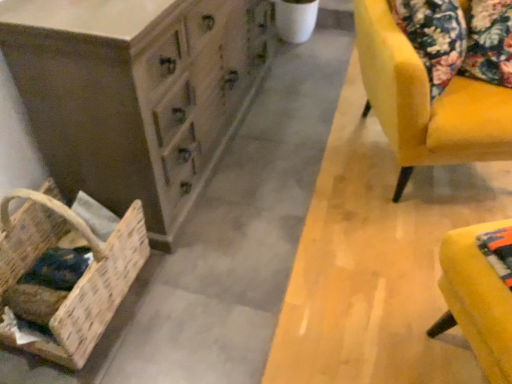
Locate an element on the screen. The height and width of the screenshot is (384, 512). free area in between velvet yellow chair at right and woven wood basket at lower left is located at coordinates (x=275, y=228).